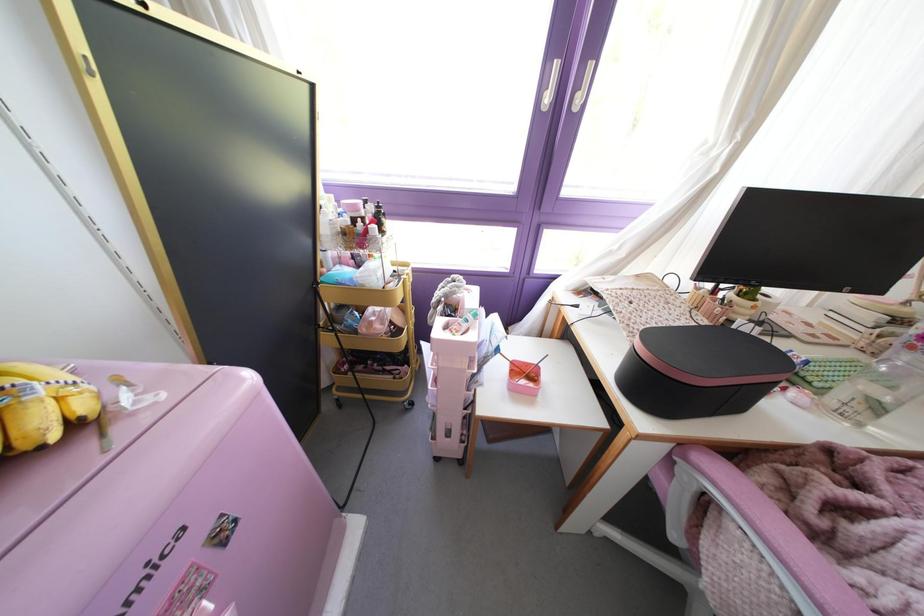
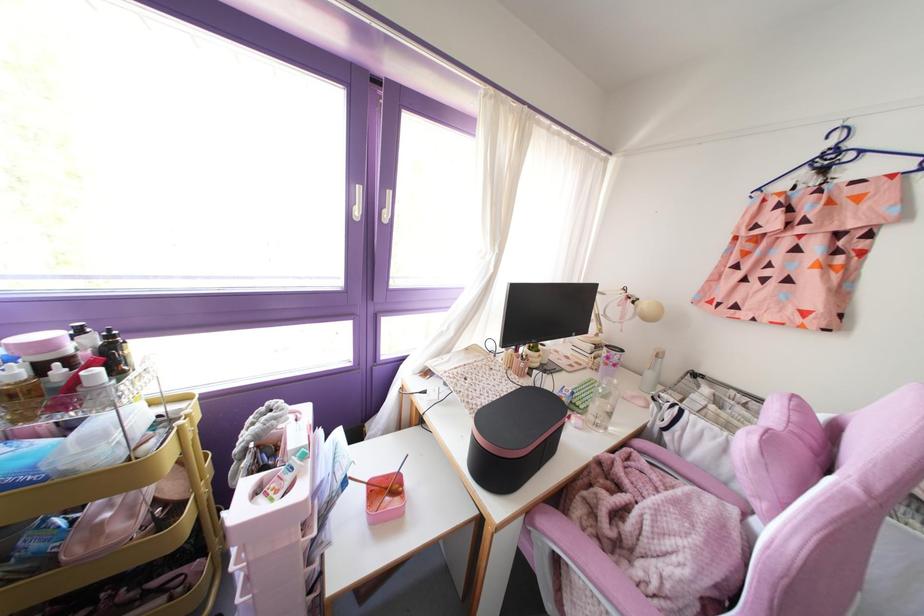
Locate, in the second image, the point that corresponds to point (546, 99) in the first image.

(357, 212)